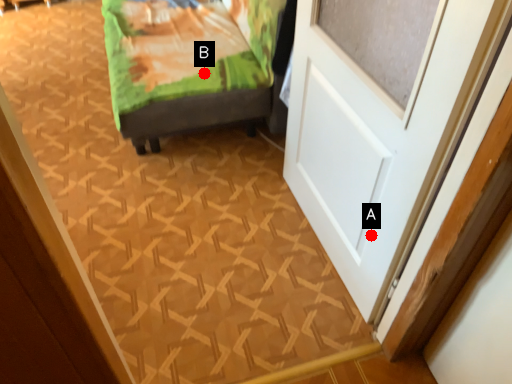
Question: Two points are circled on the image, labeled by A and B beside each circle. Which point is farther from the camera taking this photo?

Choices:
 (A) A is further
 (B) B is further

Answer: (B)